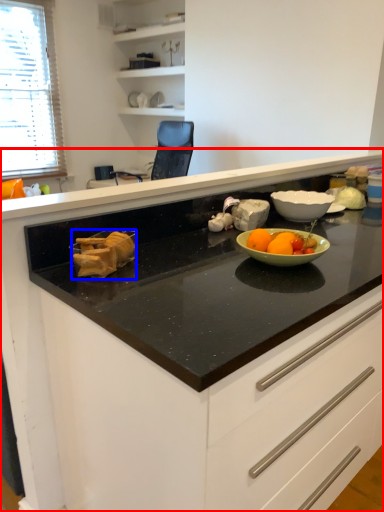
Question: Among these objects, which one is nearest to the camera, cabinetry (highlighted by a red box) or food (highlighted by a blue box)?

Choices:
 (A) cabinetry
 (B) food

Answer: (A)